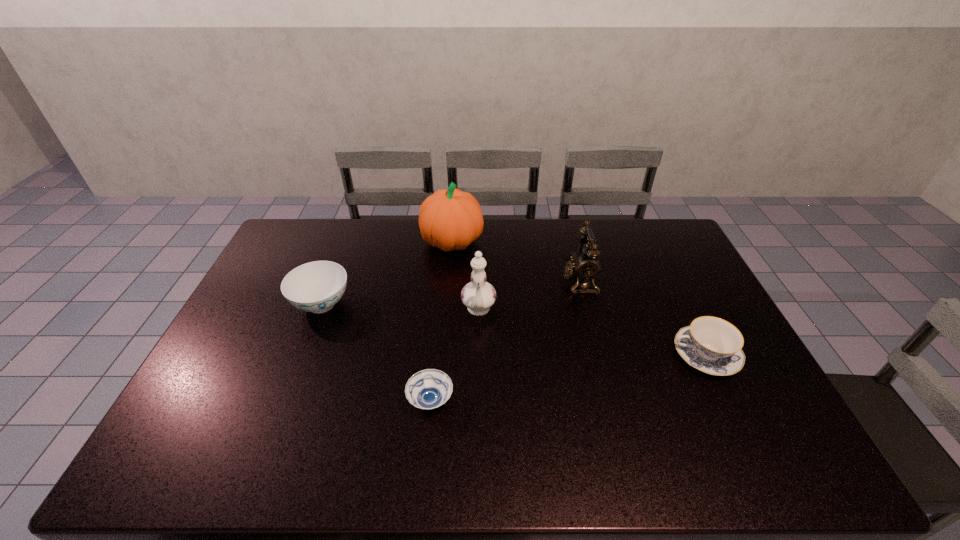
Locate an element on the screen. blank area in the image that satisfies the following two spatial constraints: 1. with the handle on the side of the rightmost object; 2. at the spout of the tallest chinaware is located at coordinates (684, 311).

At what (x,y) coordinates should I click in order to perform the action: click on free location that satisfies the following two spatial constraints: 1. at the spout of the second chinaware from left to right; 2. with the handle on the side of the rightmost object. Please return your answer as a coordinate pair (x, y). The width and height of the screenshot is (960, 540). Looking at the image, I should click on (478, 355).

Locate an element on the screen. Image resolution: width=960 pixels, height=540 pixels. free spot that satisfies the following two spatial constraints: 1. with the handle on the side of the nearest chinaware; 2. at the spout of the tallest chinaware is located at coordinates (684, 311).

The image size is (960, 540). Find the location of `free space that satisfies the following two spatial constraints: 1. on the back side of the farthest object; 2. on the right side of the leftmost chinaware`. free space that satisfies the following two spatial constraints: 1. on the back side of the farthest object; 2. on the right side of the leftmost chinaware is located at coordinates (346, 241).